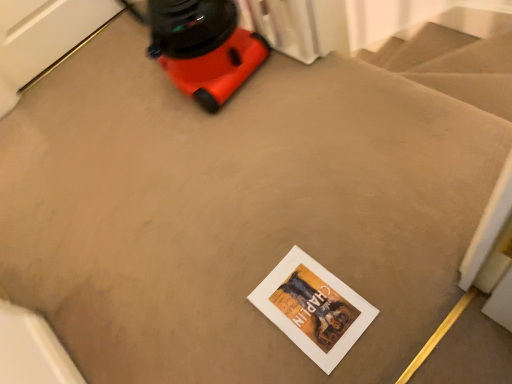
At what (x,y) coordinates should I click in order to perform the action: click on free space to the left of orange plastic vacuum cleaner at upper left. Please return your answer as a coordinate pair (x, y). Looking at the image, I should click on (73, 108).